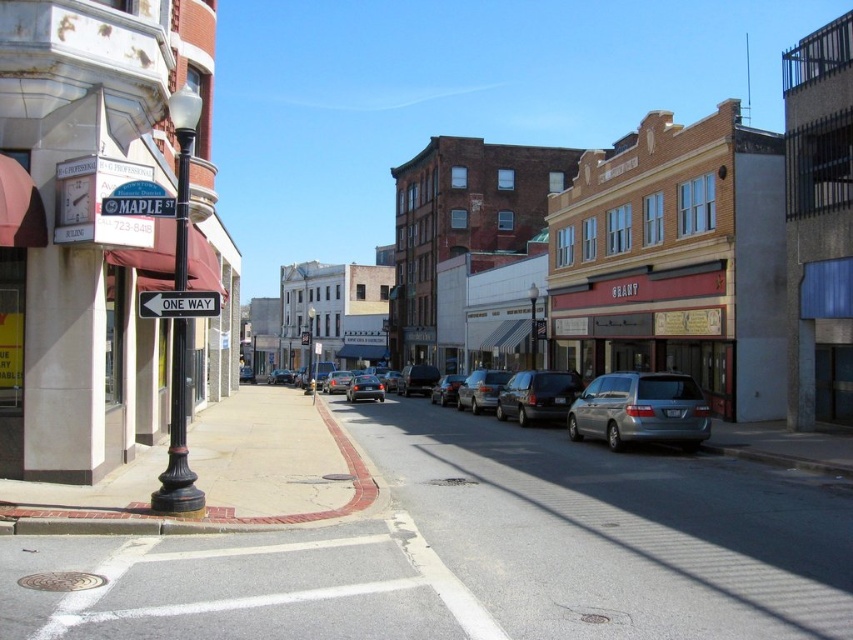
Question: Among these objects, which one is farthest from the camera?

Choices:
 (A) shiny black sedan at center
 (B) maroon awning at left
 (C) shiny silver sedan at center
 (D) black matte van at center

Answer: (A)

Question: In this image, where is satin silver minivan at center located relative to black matte van at center?

Choices:
 (A) left
 (B) right

Answer: (B)

Question: Which point is farther to the camera?

Choices:
 (A) (245, 378)
 (B) (360, 385)

Answer: (A)

Question: Can you confirm if silver metallic minivan at center is wider than metallic silver sedan at center?

Choices:
 (A) no
 (B) yes

Answer: (B)

Question: Can you confirm if silver metallic sedan at center is positioned to the left of shiny silver sedan at center?

Choices:
 (A) yes
 (B) no

Answer: (B)

Question: Which of the following is the closest to the observer?

Choices:
 (A) (566, 400)
 (B) (460, 404)

Answer: (A)